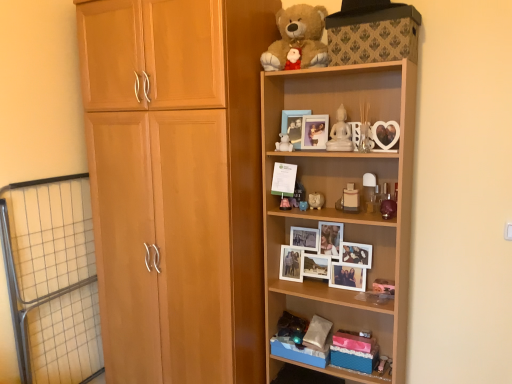
Question: Considering the relative sizes of clear glass vase at upper center, acting as the 6th toy starting from the left, and soft brown plush at upper center in the image provided, is clear glass vase at upper center, acting as the 6th toy starting from the left, wider than soft brown plush at upper center?

Choices:
 (A) no
 (B) yes

Answer: (A)

Question: Does clear glass vase at upper center, which is the 1th toy from right to left, contain soft brown plush at upper center?

Choices:
 (A) no
 (B) yes

Answer: (A)

Question: Can you confirm if clear glass vase at upper center, which is the 1th toy from right to left, is taller than soft brown plush at upper center?

Choices:
 (A) yes
 (B) no

Answer: (B)

Question: Are clear glass vase at upper center, which is the 1th toy from right to left, and soft brown plush at upper center far apart?

Choices:
 (A) yes
 (B) no

Answer: (B)

Question: From the image's perspective, would you say clear glass vase at upper center, acting as the 6th toy starting from the left, is shown under soft brown plush at upper center?

Choices:
 (A) yes
 (B) no

Answer: (A)

Question: Would you say matte blue piggy bank at center, the fifth toy viewed from the right, is inside or outside white matte teddy bear at upper center, marked as the 1th toy in a left-to-right arrangement?

Choices:
 (A) outside
 (B) inside

Answer: (A)

Question: In terms of size, does matte blue piggy bank at center, arranged as the second toy when viewed from the left, appear bigger or smaller than white matte teddy bear at upper center, marked as the 6th toy in a right-to-left arrangement?

Choices:
 (A) big
 (B) small

Answer: (B)

Question: From their relative heights in the image, would you say matte blue piggy bank at center, arranged as the second toy when viewed from the left, is taller or shorter than white matte teddy bear at upper center, marked as the 1th toy in a left-to-right arrangement?

Choices:
 (A) tall
 (B) short

Answer: (B)

Question: From the image's perspective, relative to white matte teddy bear at upper center, marked as the 6th toy in a right-to-left arrangement, is matte blue piggy bank at center, arranged as the second toy when viewed from the left, above or below?

Choices:
 (A) below
 (B) above

Answer: (A)

Question: Is white ceramic piggy bank at center, which ranks as the fourth toy in right-to-left order, spatially inside matte plastic perfume bottle at center, arranged as the 5th toy when viewed from the left, or outside of it?

Choices:
 (A) inside
 (B) outside

Answer: (B)

Question: Based on their sizes in the image, would you say white ceramic piggy bank at center, the third toy when ordered from left to right, is bigger or smaller than matte plastic perfume bottle at center, arranged as the 5th toy when viewed from the left?

Choices:
 (A) small
 (B) big

Answer: (A)

Question: From the image's perspective, is white ceramic piggy bank at center, the third toy when ordered from left to right, positioned above or below matte plastic perfume bottle at center, acting as the 2th toy starting from the right?

Choices:
 (A) above
 (B) below

Answer: (B)

Question: In terms of height, does white ceramic piggy bank at center, the third toy when ordered from left to right, look taller or shorter compared to matte plastic perfume bottle at center, arranged as the 5th toy when viewed from the left?

Choices:
 (A) tall
 (B) short

Answer: (B)

Question: From a real-world perspective, is matte plastic perfume bottle at center, arranged as the 5th toy when viewed from the left, above or below wooden shelf at upper right, the first shelf when ordered from top to bottom?

Choices:
 (A) below
 (B) above

Answer: (B)

Question: Considering the positions of matte plastic perfume bottle at center, arranged as the 5th toy when viewed from the left, and wooden shelf at upper right, the second shelf in the bottom-to-top sequence, in the image, is matte plastic perfume bottle at center, arranged as the 5th toy when viewed from the left, bigger or smaller than wooden shelf at upper right, the second shelf in the bottom-to-top sequence,?

Choices:
 (A) small
 (B) big

Answer: (A)